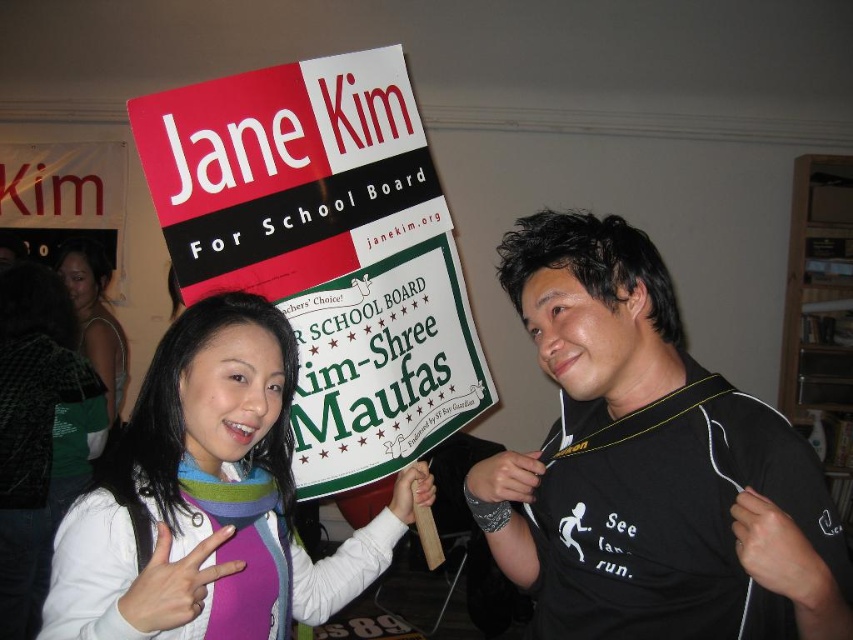
Question: Which object appears closest to the camera in this image?

Choices:
 (A) matte green dress at center
 (B) black matte shirt at center
 (C) red plastic sign at upper center
 (D) multicolored scarf at center

Answer: (B)

Question: Is red plastic sign at upper center wider than multicolored scarf at center?

Choices:
 (A) yes
 (B) no

Answer: (A)

Question: Which object is positioned closest to the matte green dress at center?

Choices:
 (A) multicolored scarf at center
 (B) black matte shirt at center
 (C) red plastic sign at upper center

Answer: (C)

Question: Does black matte shirt at center lie behind matte green dress at center?

Choices:
 (A) no
 (B) yes

Answer: (A)

Question: Can you confirm if black matte shirt at center is positioned below multicolored scarf at center?

Choices:
 (A) no
 (B) yes

Answer: (A)

Question: Estimate the real-world distances between objects in this image. Which object is closer to the red plastic sign at upper center?

Choices:
 (A) black matte shirt at center
 (B) multicolored scarf at center
 (C) matte green dress at center

Answer: (B)